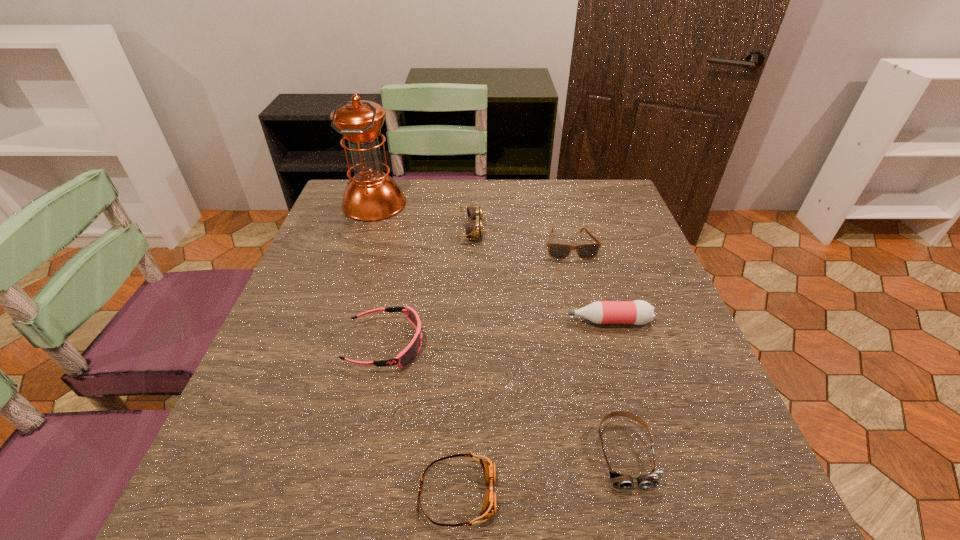
The image size is (960, 540). I want to click on goggles at the right edge, so click(623, 481).

At what (x,y) coordinates should I click in order to perform the action: click on object at the far left corner. Please return your answer as a coordinate pair (x, y). Looking at the image, I should click on (371, 195).

Where is `object at the near right corner`? The height and width of the screenshot is (540, 960). object at the near right corner is located at coordinates (623, 481).

You are a GUI agent. You are given a task and a screenshot of the screen. Output one action in this format:
    pyautogui.click(x=<x>, y=<y>)
    Task: Click on the free space at the far edge
    This screenshot has height=540, width=960.
    Given the screenshot: What is the action you would take?
    pyautogui.click(x=456, y=181)

In the image, there is a desktop. Identify the location of vacant space at the near edge. (393, 494).

Locate an element on the screen. The image size is (960, 540). vacant area at the left edge is located at coordinates (250, 387).

In the image, there is a desktop. Where is `vacant space at the right edge`? The height and width of the screenshot is (540, 960). vacant space at the right edge is located at coordinates (619, 349).

The height and width of the screenshot is (540, 960). I want to click on vacant space at the far right corner of the desktop, so click(x=605, y=188).

This screenshot has width=960, height=540. I want to click on free point between the third nearest goggles and the farthest goggles, so click(428, 287).

Image resolution: width=960 pixels, height=540 pixels. Identify the location of free space between the leftmost goggles and the sunglasses. [x=477, y=295].